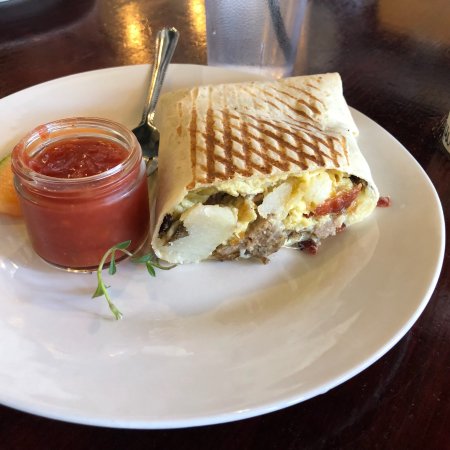
At what (x,y) coordinates should I click in order to perform the action: click on table surface. Please return your answer as a coordinate pair (x, y). The image size is (450, 450). Looking at the image, I should click on (419, 413).